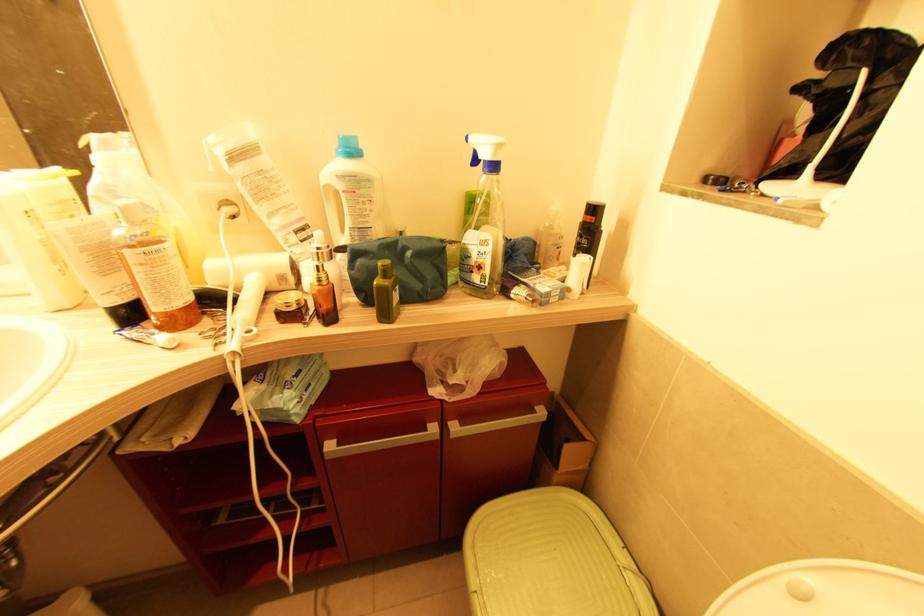
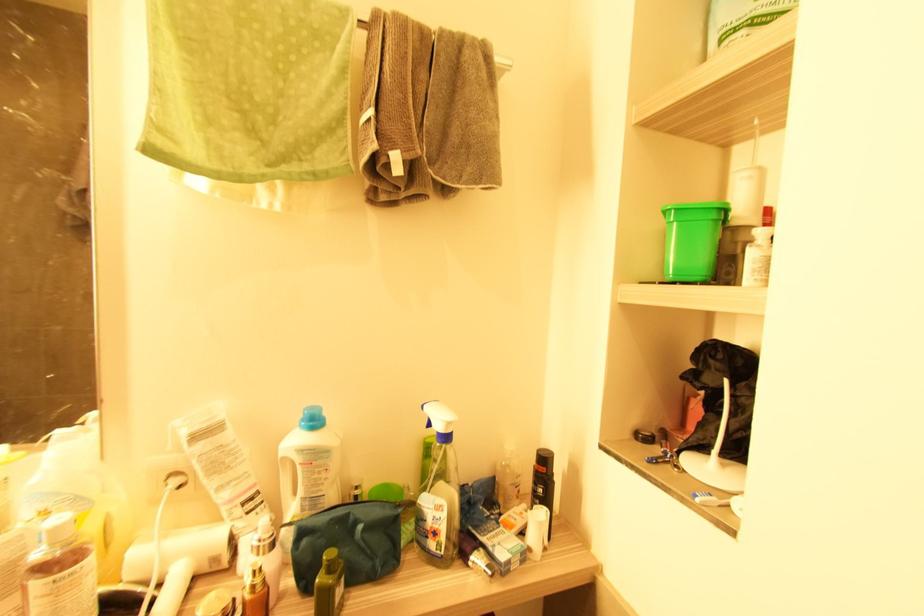
Where in the second image is the point corresponding to point 494,168 from the first image?

(447, 438)